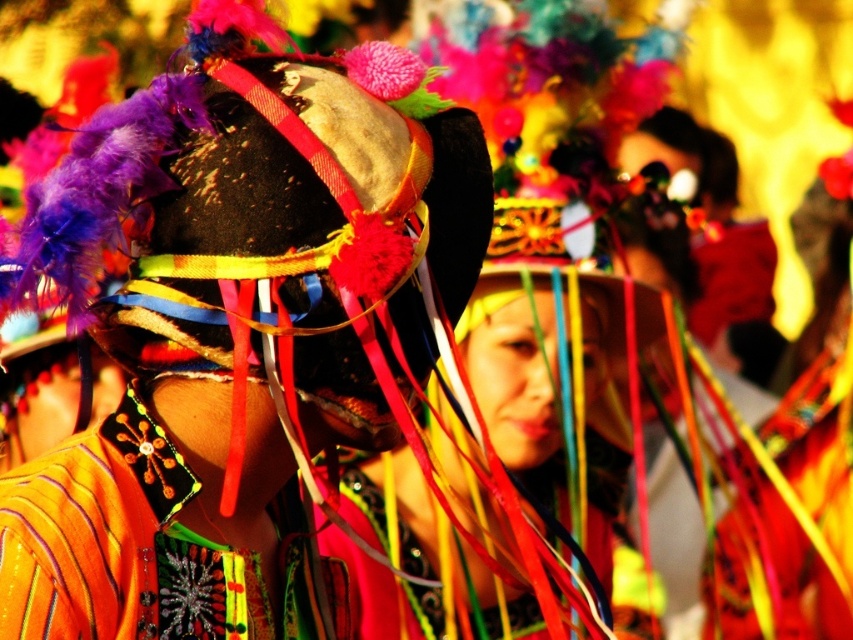
Does point (602, 321) come farther from viewer compared to point (293, 586)?

Yes, it is behind point (293, 586).

Is matte black headdress at center behind orange fabric necklace at center?

Yes, matte black headdress at center is further from the viewer.

Describe the element at coordinates (553, 369) in the screenshot. I see `matte black headdress at center` at that location.

Image resolution: width=853 pixels, height=640 pixels. Find the location of `matte black headdress at center`. matte black headdress at center is located at coordinates (553, 369).